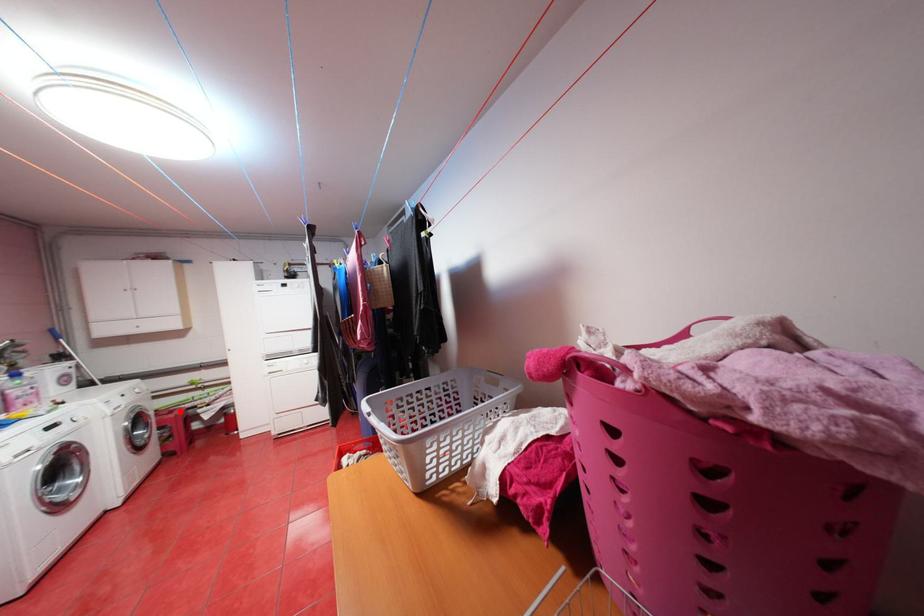
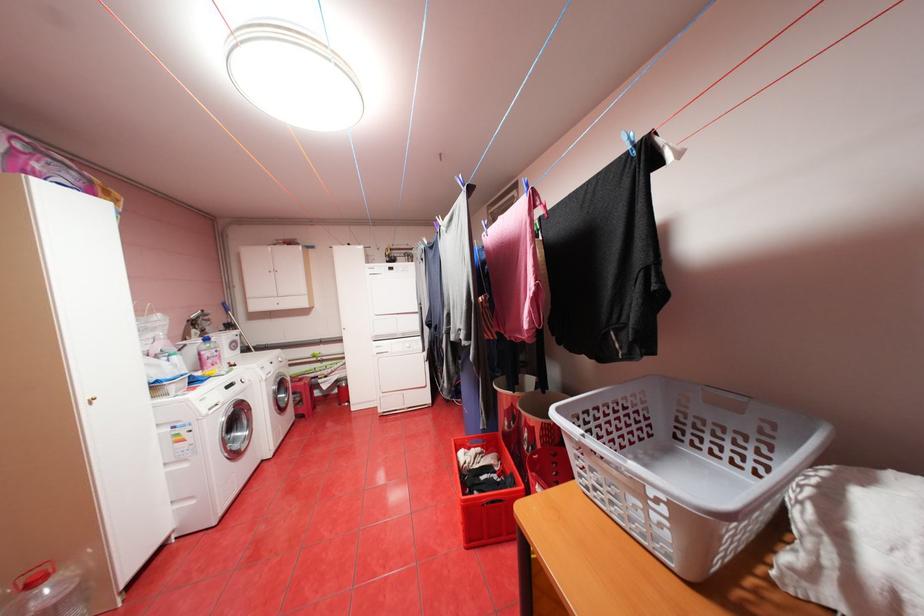
Find the pixel in the second image that matches the highlighted location in the first image.

(310, 379)